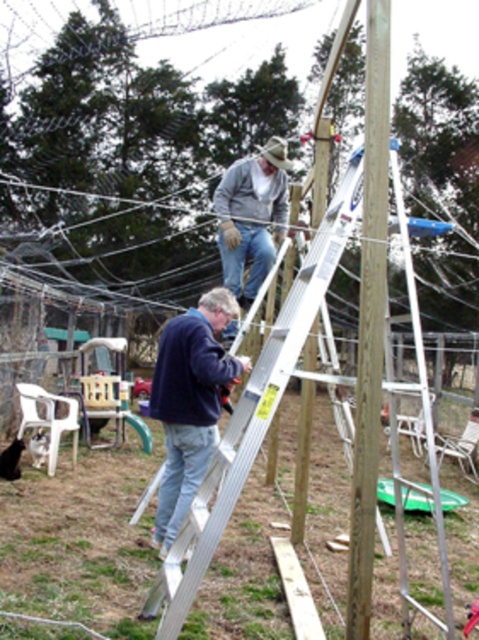
Question: Which point is farther to the camera?

Choices:
 (A) brown wood telegraph pole at center
 (B) gray woolen sweater at upper center
 (C) silver metallic ladder at upper center

Answer: (B)

Question: Does brown wood telegraph pole at center lie in front of gray woolen sweater at upper center?

Choices:
 (A) no
 (B) yes

Answer: (B)

Question: Can you confirm if silver metallic ladder at upper center is bigger than gray woolen sweater at upper center?

Choices:
 (A) no
 (B) yes

Answer: (A)

Question: Which point is farther from the camera taking this photo?

Choices:
 (A) (252, 227)
 (B) (155, 368)
 (C) (244, 458)

Answer: (B)

Question: Which object appears farthest from the camera in this image?

Choices:
 (A) navy blue sweater at center
 (B) gray woolen sweater at upper center

Answer: (B)

Question: In this image, where is silver metallic ladder at upper center located relative to navy blue sweater at center?

Choices:
 (A) right
 (B) left

Answer: (A)